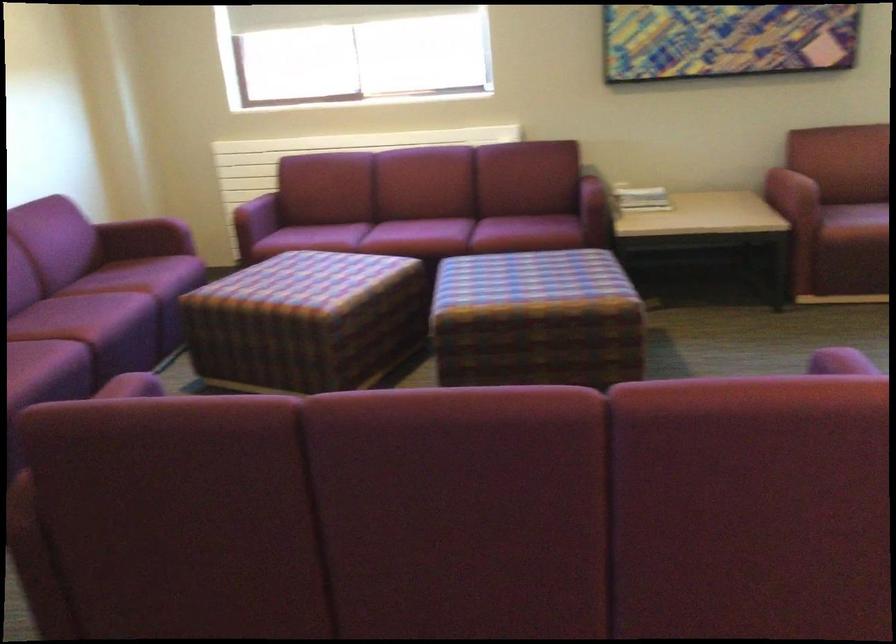
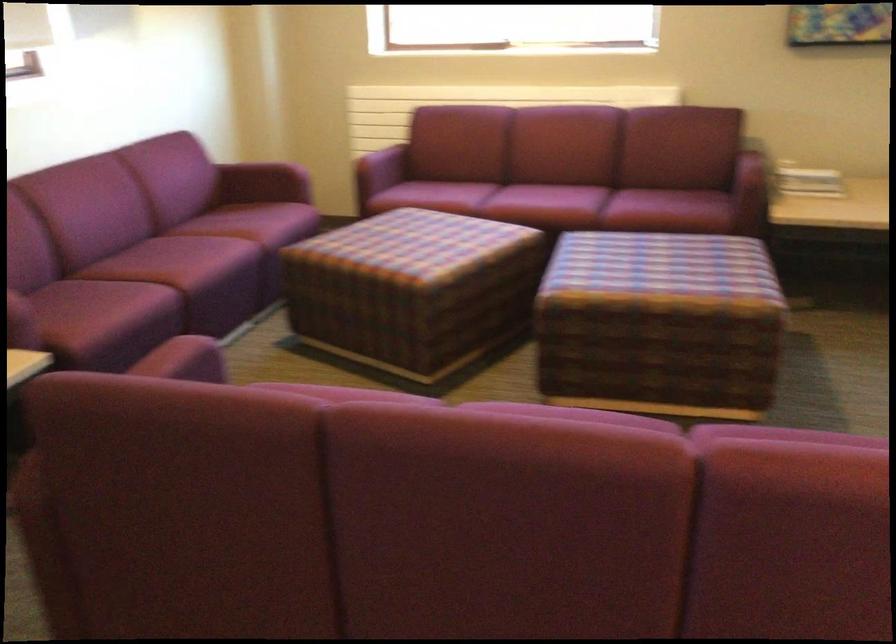
Locate, in the second image, the point that corresponds to [538,325] in the first image.

(659, 324)